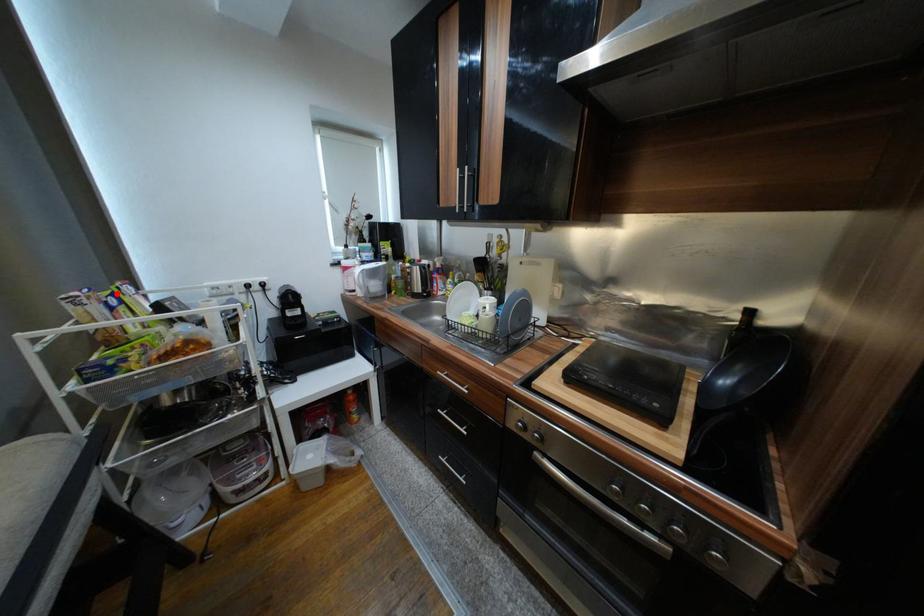
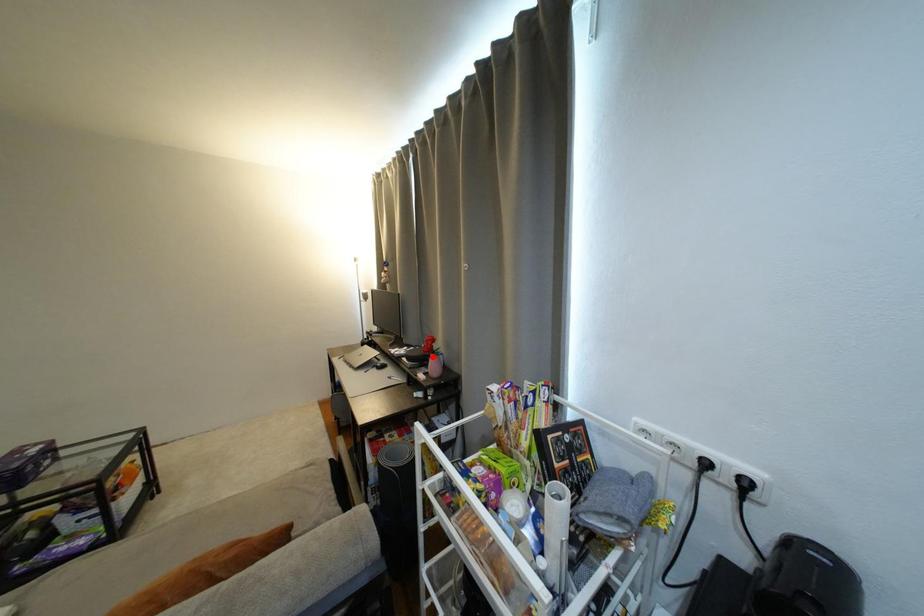
I am providing you with two images of the same scene from different viewpoints. A red point is marked on the first image and another point is marked on the second image. Is the red point in image1 aligned with the point shown in image2?

No